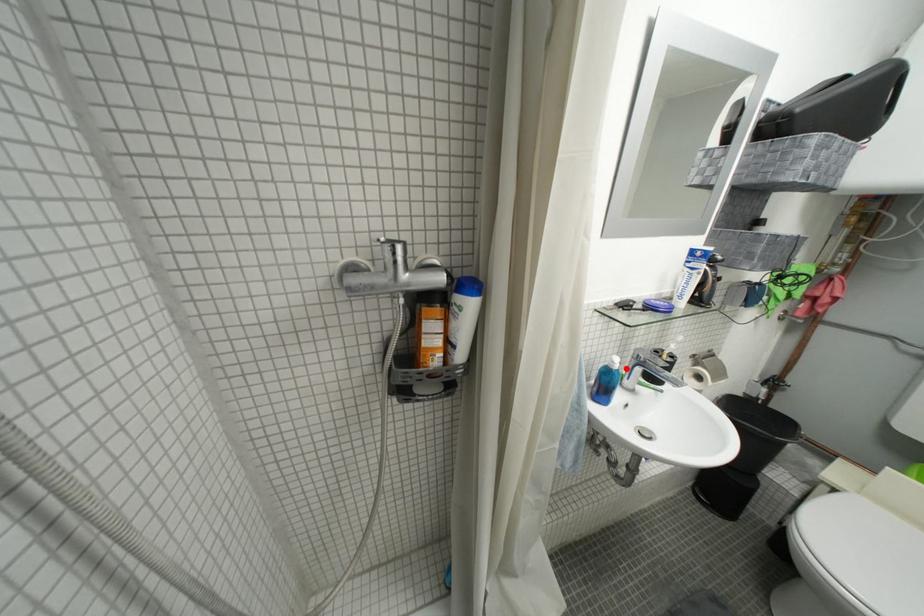
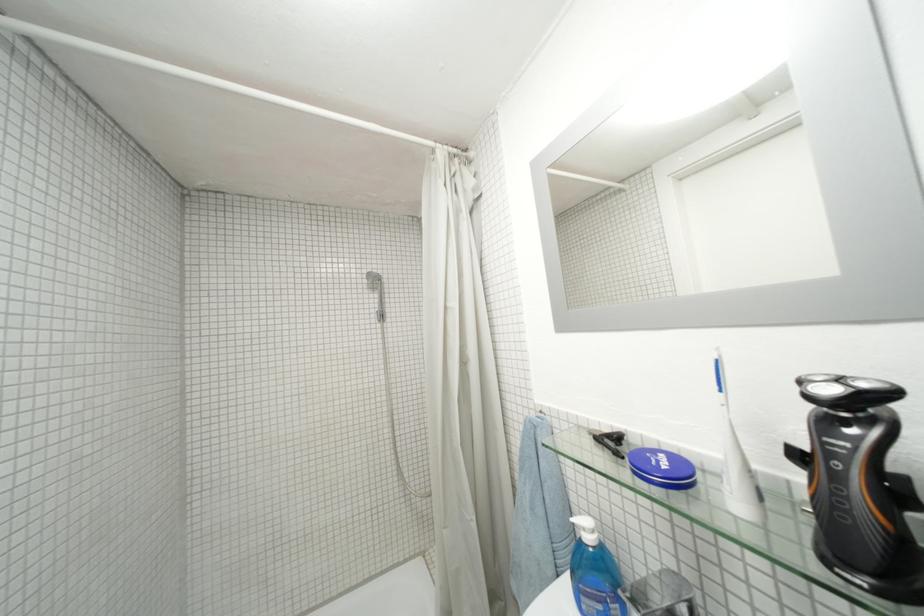
The point at the highlighted location is marked in the first image. Where is the corresponding point in the second image?

(598, 541)